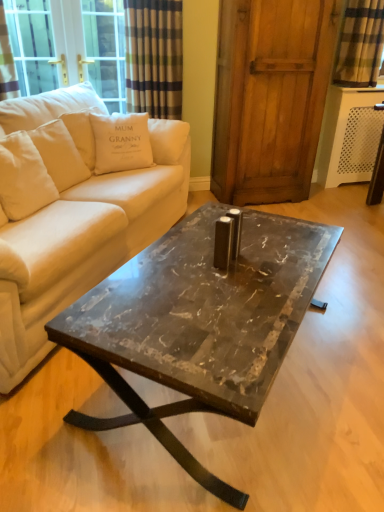
Where is `vacant space underneath plaid fabric curtain at upper right (from a real-world perspective)`? This screenshot has height=512, width=384. vacant space underneath plaid fabric curtain at upper right (from a real-world perspective) is located at coordinates (357, 88).